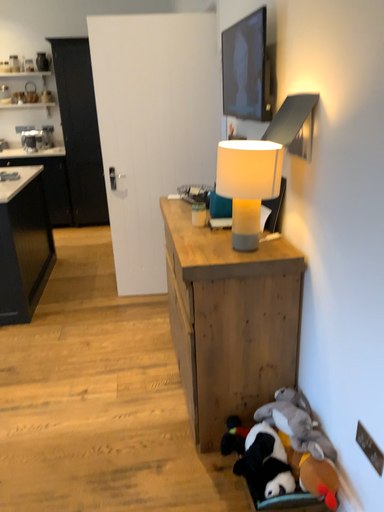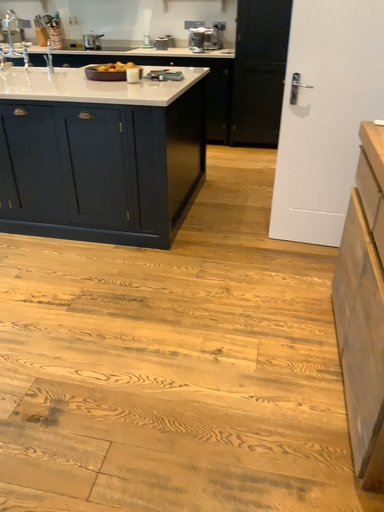
Question: How did the camera likely rotate when shooting the video?

Choices:
 (A) rotated downward
 (B) rotated upward

Answer: (A)